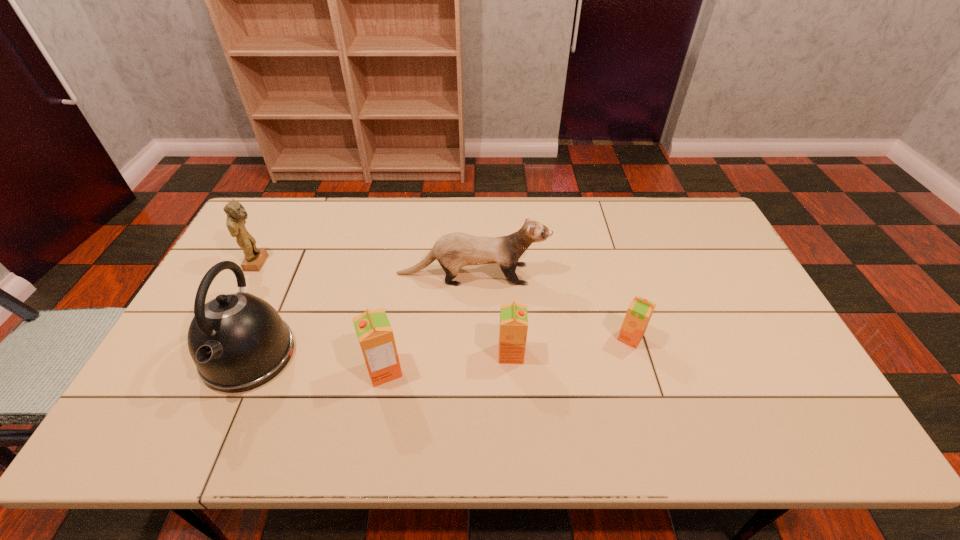
Where is `the leftmost orange juice`? This screenshot has height=540, width=960. the leftmost orange juice is located at coordinates (374, 332).

The image size is (960, 540). I want to click on the second tallest orange juice, so click(513, 328).

At what (x,y) coordinates should I click in order to perform the action: click on the shortest orange juice. Please return your answer as a coordinate pair (x, y). This screenshot has width=960, height=540. Looking at the image, I should click on (638, 315).

Locate an element on the screen. the rightmost object is located at coordinates (638, 315).

The image size is (960, 540). Identify the location of ferret. (453, 251).

Image resolution: width=960 pixels, height=540 pixels. What are the coordinates of `figurine` in the screenshot? It's located at (254, 258).

Find the location of a particular element. The width and height of the screenshot is (960, 540). the tallest object is located at coordinates (238, 341).

Locate an element on the screen. This screenshot has height=540, width=960. vacant area situated on the right of the leftmost orange juice is located at coordinates (463, 370).

You are a GUI agent. You are given a task and a screenshot of the screen. Output one action in this format:
    pyautogui.click(x=<x>, y=<y>)
    Task: Click on the free space located 0.180m on the back of the second orange juice from right to left
    Image resolution: width=960 pixels, height=540 pixels.
    Given the screenshot: What is the action you would take?
    click(x=508, y=294)

Find the location of a particular element. free spot located 0.080m on the right of the rightmost orange juice is located at coordinates (674, 338).